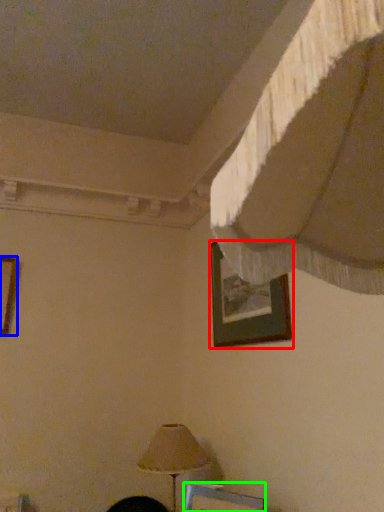
Question: Which object is positioned closest to picture frame (highlighted by a red box)? Select from picture frame (highlighted by a blue box) and picture frame (highlighted by a green box).

Choices:
 (A) picture frame
 (B) picture frame

Answer: (B)